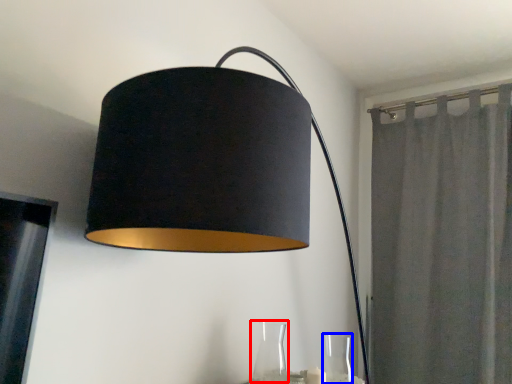
Question: Among these objects, which one is nearest to the camera, glass vase (highlighted by a red box) or glass vase (highlighted by a blue box)?

Choices:
 (A) glass vase
 (B) glass vase

Answer: (A)